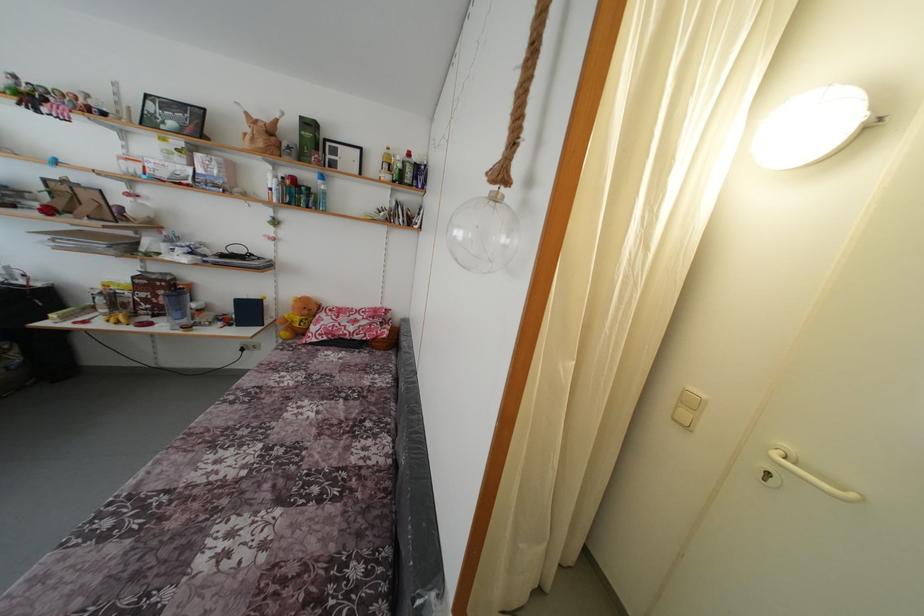
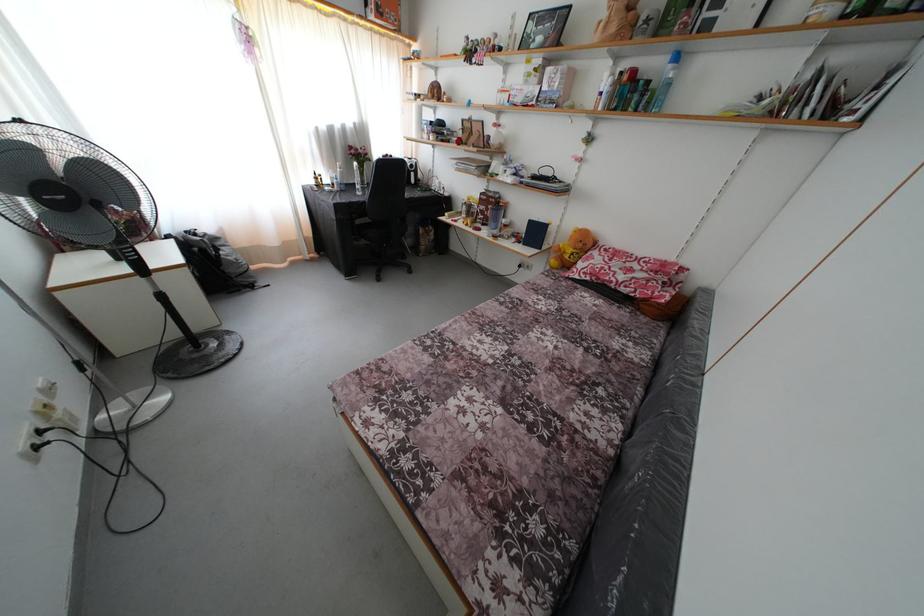
The images are taken continuously from a first-person perspective. In which direction is your viewpoint rotating?

The camera's rotation is toward left-down.